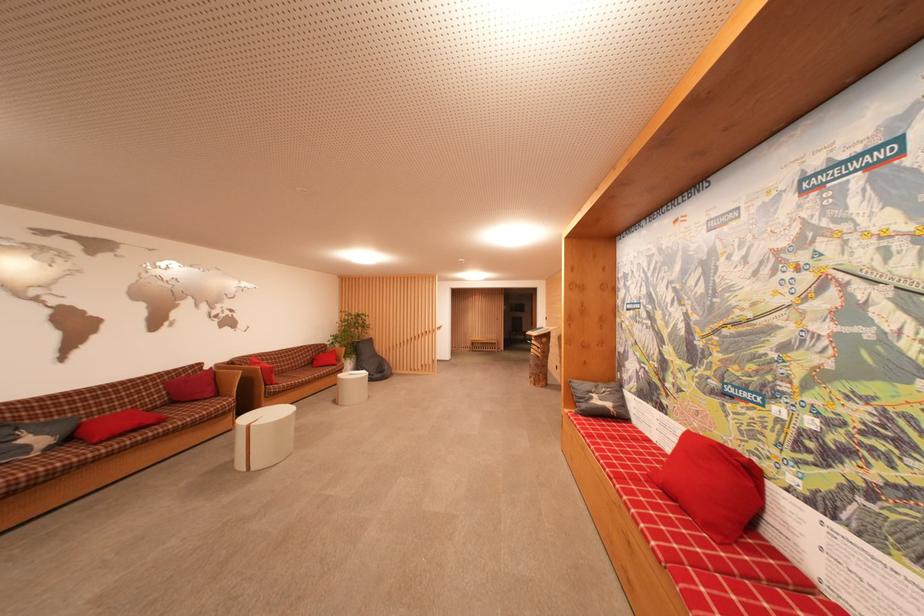
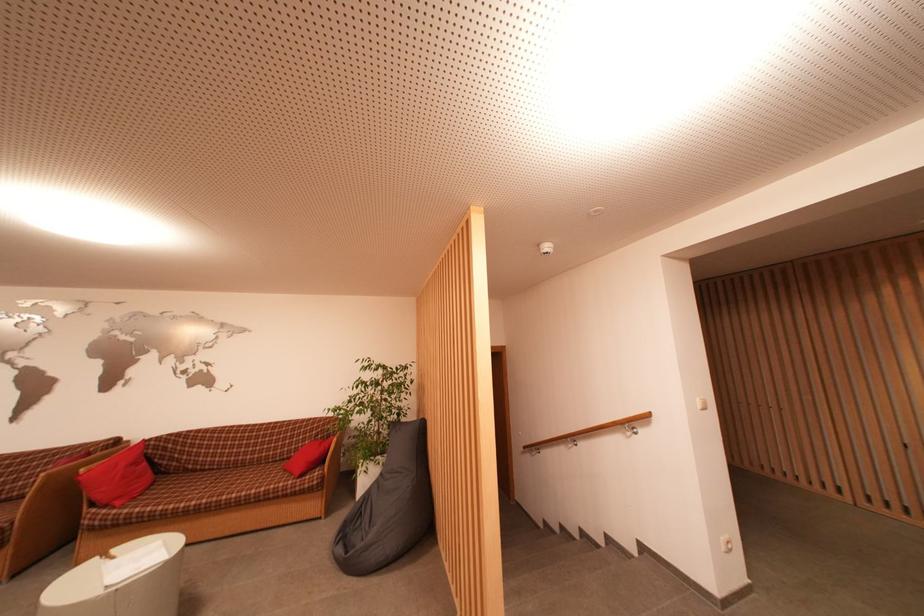
The point at (374,345) is marked in the first image. Where is the corresponding point in the second image?

(426, 430)